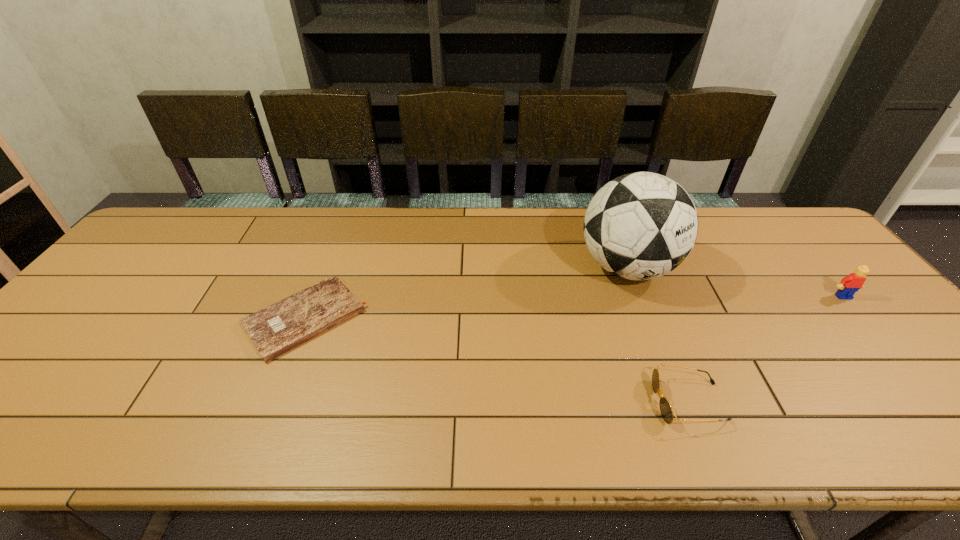
The image size is (960, 540). I want to click on the tallest object, so click(639, 226).

Where is `the rightmost object`? This screenshot has height=540, width=960. the rightmost object is located at coordinates (850, 284).

At what (x,y) coordinates should I click in order to perform the action: click on the second tallest object. Please return your answer as a coordinate pair (x, y). Looking at the image, I should click on (850, 284).

Where is `the nearest object`? The width and height of the screenshot is (960, 540). the nearest object is located at coordinates (666, 411).

Identify the location of the second shortest object. This screenshot has width=960, height=540. (666, 411).

Where is `the leftmost object`? the leftmost object is located at coordinates (274, 330).

Identify the location of Bible. (274, 330).

You are a GUI agent. You are given a task and a screenshot of the screen. Output one action in this format:
    pyautogui.click(x=<x>, y=<y>)
    Task: Click on the vacant space situated on the surface of the soccer ball where the brand logo is visible
    This screenshot has height=540, width=960.
    Given the screenshot: What is the action you would take?
    pyautogui.click(x=650, y=328)

What are the coordinates of `vacant area situated on the face of the Lego` in the screenshot? It's located at (863, 319).

Where is `vacant area situated 0.390m on the front-facing side of the sunglasses`? The width and height of the screenshot is (960, 540). vacant area situated 0.390m on the front-facing side of the sunglasses is located at coordinates (476, 402).